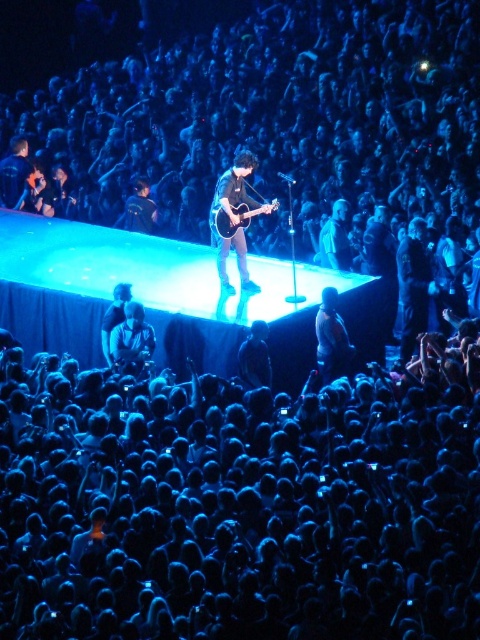
You are a photographer at the concert and want to capture the shiny black guitar at center and the dark blue fabric at lower right in the same frame. Based on their positions, which object should you focus on first to ensure both are in the shot?

Since the shiny black guitar at center is to the left of the dark blue fabric at lower right, you should focus on the shiny black guitar at center first to ensure both objects are included in the frame.

You are a photographer at the concert and want to take a closeup shot of the shiny black guitar at center. The camera you are using has a focus point at position point (235, 220). Will the guitar be in focus?

The shiny black guitar at center is located at point (235, 220), so the guitar will be in focus since the focus point is exactly at its location.

You are a photographer at the concert. You want to take a photo of the shiny black guitar at center and the dark blue fabric at lower right. Which object should you focus on first if you want to capture both in one frame without moving the camera?

The shiny black guitar at center is taller than the dark blue fabric at lower right. To capture both in one frame without moving the camera, focus on the shiny black guitar at center first since it is taller and might require adjusting the framing to include the smaller dark blue fabric at lower right.